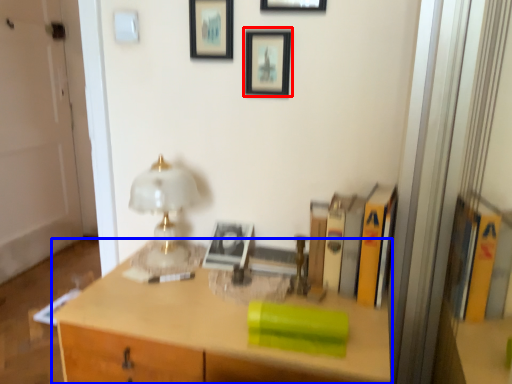
Question: Which object is further to the camera taking this photo, picture frame (highlighted by a red box) or desk (highlighted by a blue box)?

Choices:
 (A) picture frame
 (B) desk

Answer: (A)